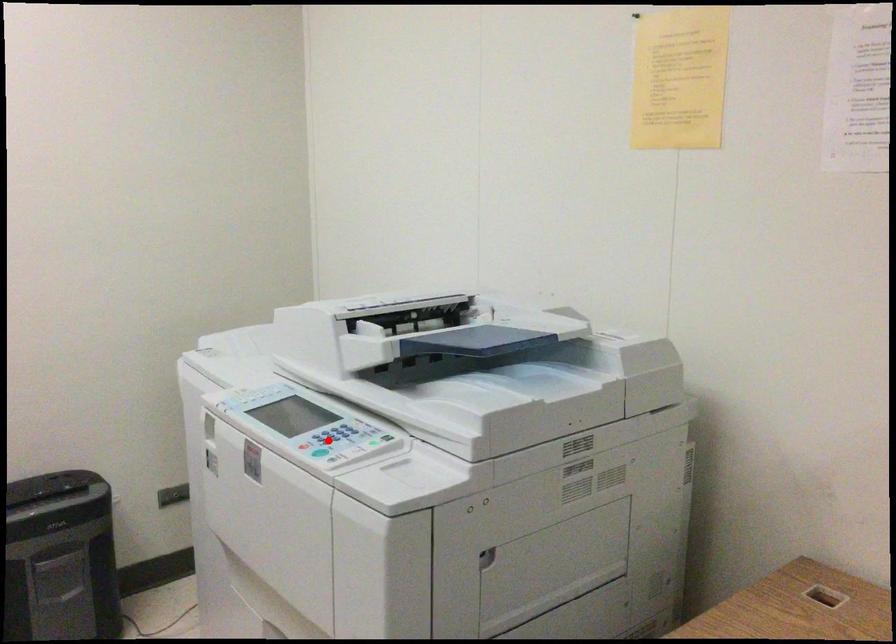
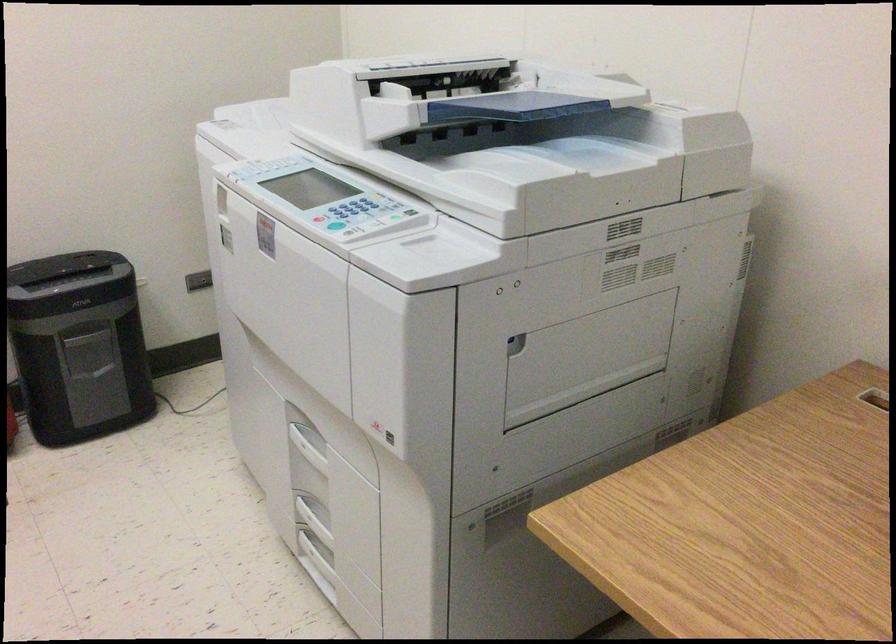
The point at the highlighted location is marked in the first image. Where is the corresponding point in the second image?

(343, 214)